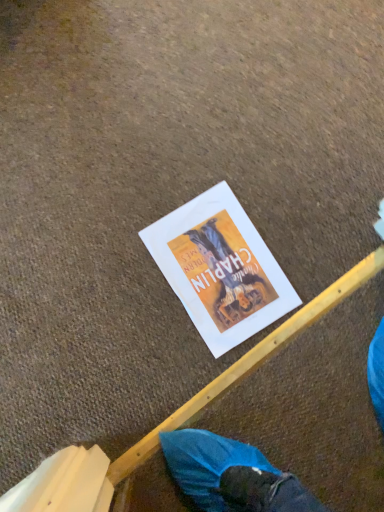
The width and height of the screenshot is (384, 512). Find the location of `vacant space behind matte paper flyer at center`. vacant space behind matte paper flyer at center is located at coordinates (276, 177).